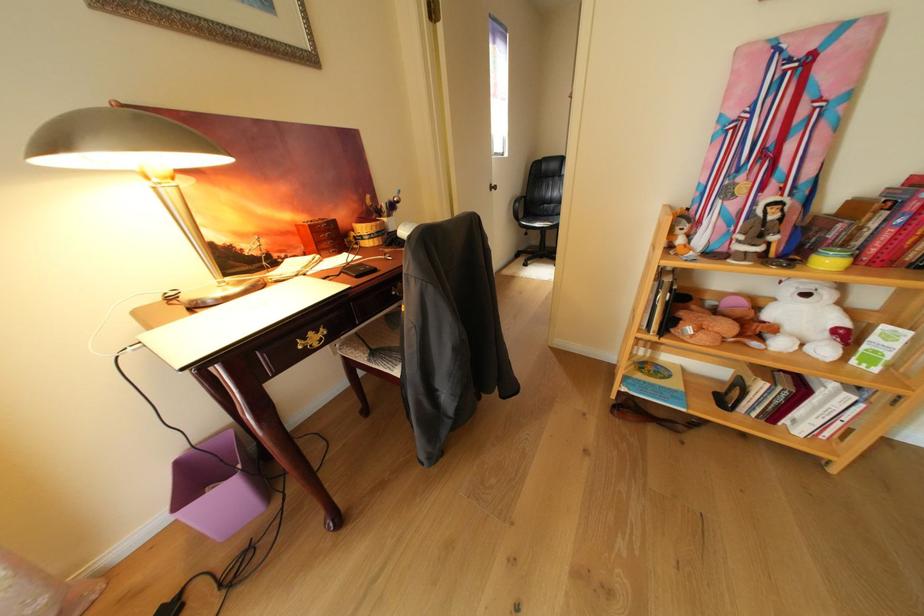
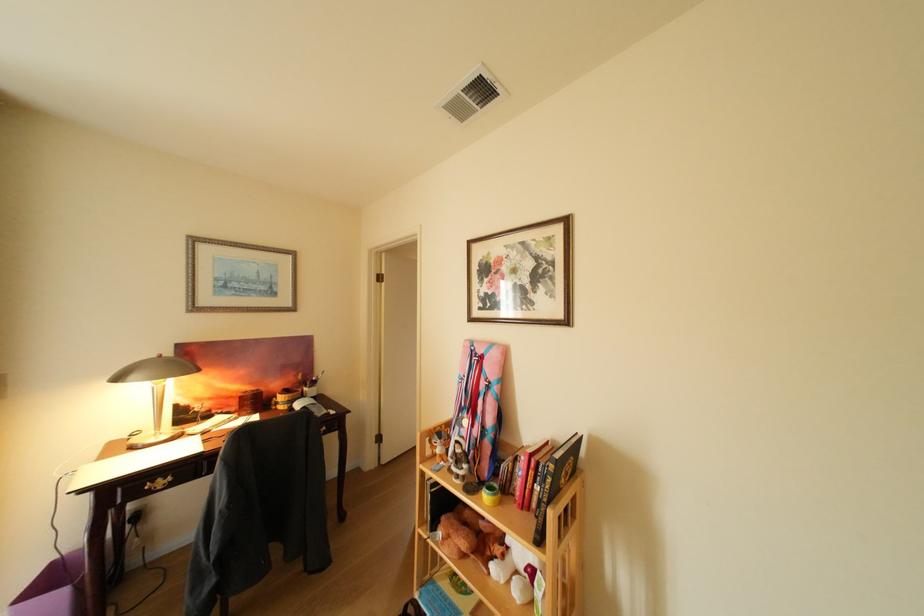
In the second image, find the point that corresponds to (x=382, y=198) in the first image.

(313, 376)